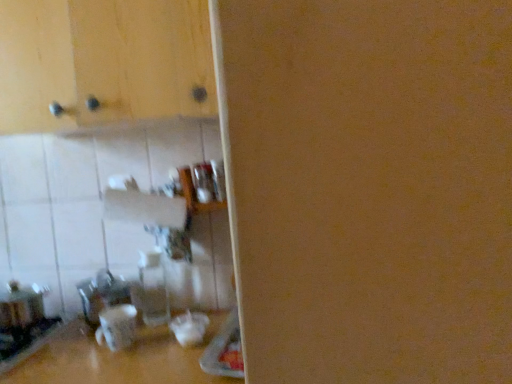
Question: Is transparent glass bottle at center bigger or smaller than metallic silver toaster at lower left?

Choices:
 (A) big
 (B) small

Answer: (B)

Question: From a real-world perspective, is transparent glass bottle at center physically located above or below metallic silver toaster at lower left?

Choices:
 (A) below
 (B) above

Answer: (B)

Question: Considering the real-world distances, which object is closest to the metallic silver toaster at lower left?

Choices:
 (A) matte wood cabinet at upper left
 (B) transparent glass bottle at center

Answer: (B)

Question: Which of these objects is positioned farthest from the transparent glass bottle at center?

Choices:
 (A) metallic silver toaster at lower left
 (B) matte wood cabinet at upper left

Answer: (B)